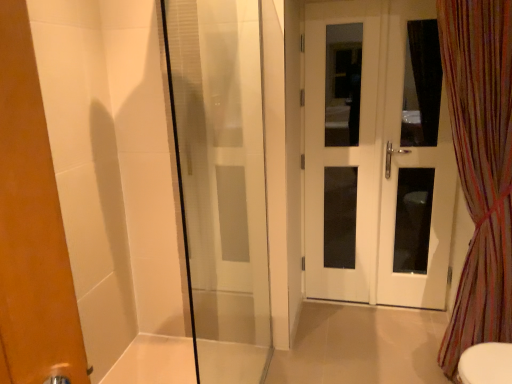
The image size is (512, 384). Identify the location of free spot to the left of white glass door at right, the 1th screen door positioned from the right. (377, 326).